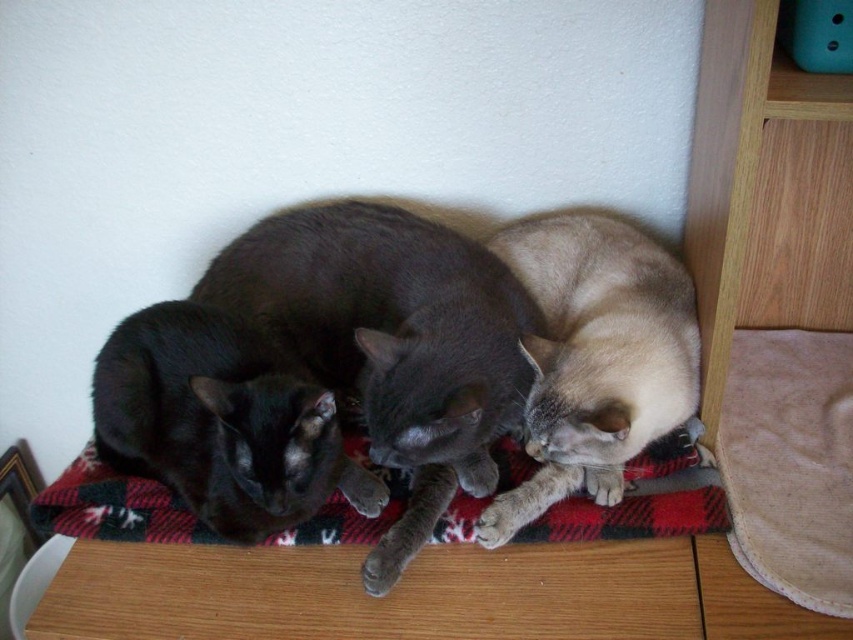
You are standing in front of the cats on the red and black checkered blanket. There is a point at coordinates (x=392, y=342). Which cat is this point located on?

The point at (x=392, y=342) is on the shiny black cat at center.

You are holding a camera and want to take a closeup photo of the shiny black cat at center. The camera requires a minimum distance of 30 inches to focus properly. Can you take the photo without moving the cat?

Yes, the distance between the shiny black cat at center and the camera is 35.73 inches, which is more than the required 30 inches, so the camera can focus properly.